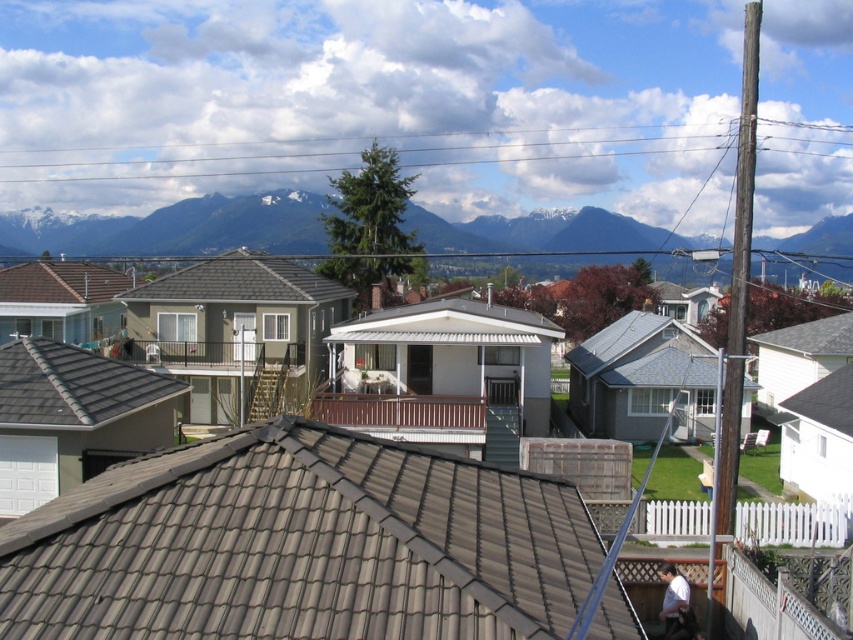
You are a drone operator tasked with capturing aerial footage of the neighborhood. You notice two brown tile roofs in the image. Which of the two brown tile roofs, the brown tile roof at upper center or the brown tile roof at upper left, is smaller in size?

The brown tile roof at upper center is smaller in size compared to the brown tile roof at upper left.

You are a drone operator who needs to deliver a package to the gray tile roof at lower left and the brown tile roof at upper left. Since you have limited battery, you want to know which roof is smaller to land on first. According to the image, which roof is smaller?

The gray tile roof at lower left is smaller than the brown tile roof at upper left, so you should land on the gray tile roof at lower left first to conserve battery.